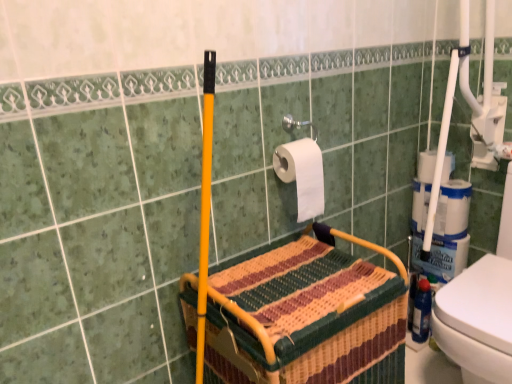
Question: Does woven fabric basket at center come behind white matte toilet paper at upper center, which is the 2th toilet paper from right to left?

Choices:
 (A) no
 (B) yes

Answer: (A)

Question: Can you confirm if woven fabric basket at center is wider than white matte toilet paper at upper center, which is the 2th toilet paper from right to left?

Choices:
 (A) no
 (B) yes

Answer: (B)

Question: Does woven fabric basket at center touch white matte toilet paper at upper center, marked as the 1th toilet paper in a left-to-right arrangement?

Choices:
 (A) yes
 (B) no

Answer: (B)

Question: From a real-world perspective, is woven fabric basket at center under white matte toilet paper at upper center, which is the 2th toilet paper from right to left?

Choices:
 (A) yes
 (B) no

Answer: (A)

Question: From the image's perspective, is woven fabric basket at center on top of white matte toilet paper at upper center, the 1th toilet paper from the front?

Choices:
 (A) yes
 (B) no

Answer: (B)

Question: Do you think white matte toilet paper at upper center, which is the 2th toilet paper from right to left, is within white matte toilet paper at right, which ranks as the 2th toilet paper in left-to-right order, or outside of it?

Choices:
 (A) outside
 (B) inside

Answer: (A)

Question: Considering the positions of white matte toilet paper at upper center, which is the 2th toilet paper from right to left, and white matte toilet paper at right, which ranks as the 2th toilet paper in left-to-right order, in the image, is white matte toilet paper at upper center, which is the 2th toilet paper from right to left, bigger or smaller than white matte toilet paper at right, which ranks as the 2th toilet paper in left-to-right order,?

Choices:
 (A) big
 (B) small

Answer: (A)

Question: In terms of width, does white matte toilet paper at upper center, the 1th toilet paper from the front, look wider or thinner when compared to white matte toilet paper at right, which ranks as the 2th toilet paper in left-to-right order?

Choices:
 (A) thin
 (B) wide

Answer: (A)

Question: Is white matte toilet paper at upper center, which is the 2th toilet paper from right to left, taller or shorter than white matte toilet paper at right, which ranks as the 2th toilet paper in left-to-right order?

Choices:
 (A) tall
 (B) short

Answer: (A)

Question: Based on their sizes in the image, would you say white matte toilet paper at upper center, the 2th toilet paper viewed from the back, is bigger or smaller than woven fabric basket at center?

Choices:
 (A) big
 (B) small

Answer: (B)

Question: Is white matte toilet paper at upper center, marked as the 1th toilet paper in a left-to-right arrangement, wider or thinner than woven fabric basket at center?

Choices:
 (A) thin
 (B) wide

Answer: (A)

Question: Considering the positions of white matte toilet paper at upper center, the 2th toilet paper viewed from the back, and woven fabric basket at center in the image, is white matte toilet paper at upper center, the 2th toilet paper viewed from the back, taller or shorter than woven fabric basket at center?

Choices:
 (A) tall
 (B) short

Answer: (B)

Question: From a real-world perspective, is white matte toilet paper at upper center, the 2th toilet paper viewed from the back, physically located above or below woven fabric basket at center?

Choices:
 (A) below
 (B) above

Answer: (B)

Question: From a real-world perspective, relative to blue plastic bottle at lower right, is white matte toilet paper at upper center, the 2th toilet paper viewed from the back, vertically above or below?

Choices:
 (A) below
 (B) above

Answer: (B)

Question: From their relative heights in the image, would you say white matte toilet paper at upper center, marked as the 1th toilet paper in a left-to-right arrangement, is taller or shorter than blue plastic bottle at lower right?

Choices:
 (A) tall
 (B) short

Answer: (B)